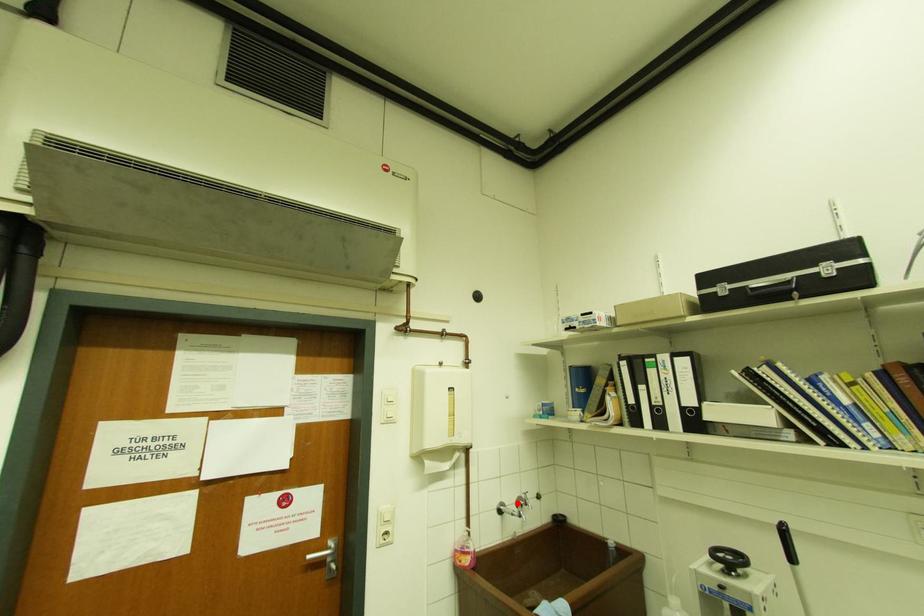
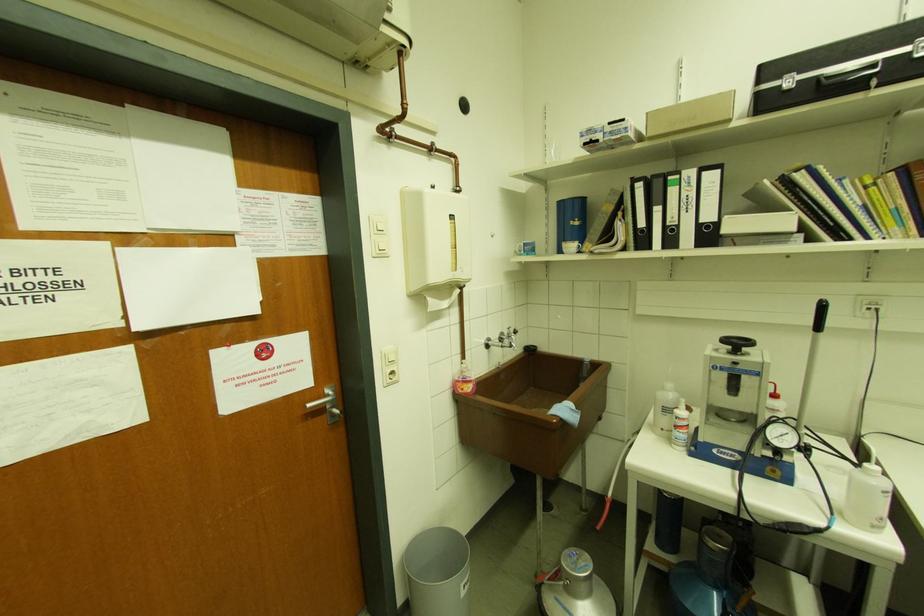
Question: I am providing you with two images of the same scene from different viewpoints. A red point is marked on the first image. Can you still see the location of the red point in image 2?

Choices:
 (A) Yes
 (B) No

Answer: (A)